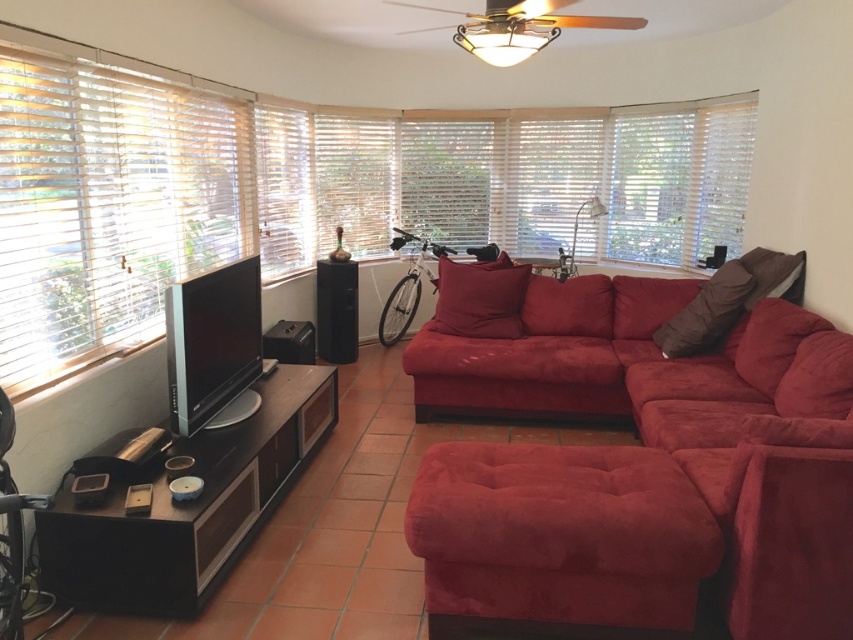
Is velvet red ottoman at lower right to the right of brown suede pillow at right from the viewer's perspective?

In fact, velvet red ottoman at lower right is to the left of brown suede pillow at right.

Which is behind, point (685, 488) or point (689, 321)?

The point (689, 321) is more distant.

Does point (599, 618) lie in front of point (709, 326)?

That is True.

Where is `velvet red ottoman at lower right`? This screenshot has width=853, height=640. velvet red ottoman at lower right is located at coordinates (560, 536).

Can you confirm if wooden blinds at center is positioned above white wood blinds at left?

Yes, wooden blinds at center is above white wood blinds at left.

Who is positioned more to the left, wooden blinds at center or white wood blinds at left?

white wood blinds at left

Locate an element on the screen. This screenshot has height=640, width=853. wooden blinds at center is located at coordinates (306, 188).

Image resolution: width=853 pixels, height=640 pixels. I want to click on wooden blinds at center, so click(306, 188).

Is white wood blinds at left below velvet red ottoman at lower right?

Incorrect, white wood blinds at left is not positioned below velvet red ottoman at lower right.

Can you confirm if white wood blinds at left is positioned to the left of velvet red ottoman at lower right?

Correct, you'll find white wood blinds at left to the left of velvet red ottoman at lower right.

Who is more distant from viewer, (184, 141) or (553, 595)?

Positioned behind is point (184, 141).

Image resolution: width=853 pixels, height=640 pixels. What are the coordinates of `white wood blinds at left` in the screenshot? It's located at (108, 198).